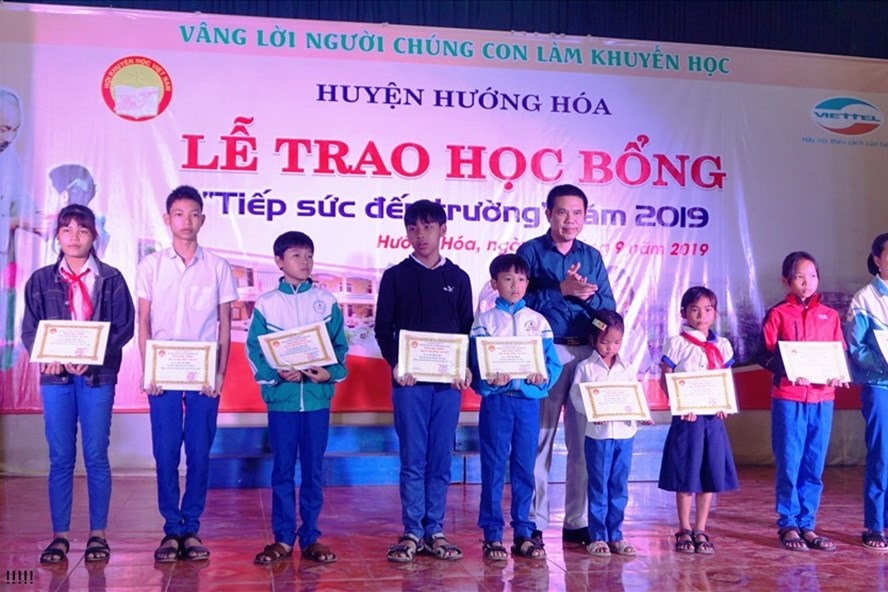
The image size is (888, 592). In order to click on brown floor in this screenshot , I will do `click(357, 558)`.